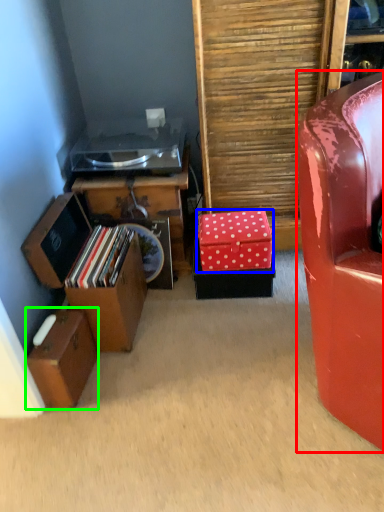
Question: Which object is positioned farthest from chair (highlighted by a red box)? Select from storage box (highlighted by a blue box) and storage box (highlighted by a green box).

Choices:
 (A) storage box
 (B) storage box

Answer: (B)